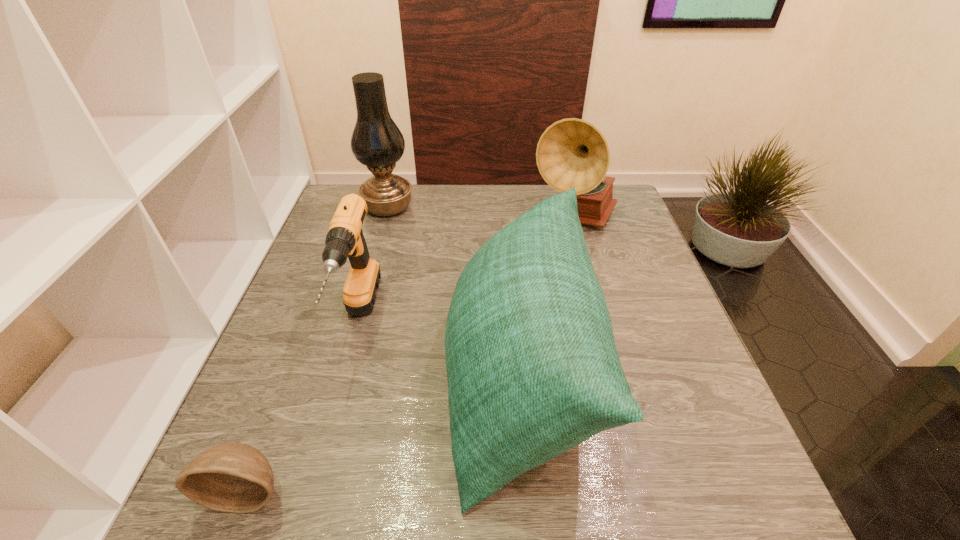
This screenshot has height=540, width=960. What are the coordinates of `free space located 0.160m at the tip of the drill` in the screenshot? It's located at (321, 456).

You are a GUI agent. You are given a task and a screenshot of the screen. Output one action in this format:
    pyautogui.click(x=<x>, y=<y>)
    Task: Click on the vacant region located on the back of the bowl
    
    Given the screenshot: What is the action you would take?
    pyautogui.click(x=283, y=399)

You are a GUI agent. You are given a task and a screenshot of the screen. Output one action in this format:
    pyautogui.click(x=<x>, y=<y>)
    Task: Click on the oil lamp located in the far edge section of the desktop
    The width and height of the screenshot is (960, 540).
    Given the screenshot: What is the action you would take?
    pyautogui.click(x=376, y=142)

I want to click on phonograph record present at the far edge, so click(572, 152).

Find the location of `cushion that is at the near edge`. cushion that is at the near edge is located at coordinates coord(532,367).

Identify the location of bowl that is positioned at the near edge. The width and height of the screenshot is (960, 540). [233, 477].

You are a GUI agent. You are given a task and a screenshot of the screen. Output one action in this format:
    pyautogui.click(x=<x>, y=<y>)
    Task: Click on the oil lamp present at the left edge
    This screenshot has width=960, height=540.
    Given the screenshot: What is the action you would take?
    pyautogui.click(x=376, y=142)

The image size is (960, 540). I want to click on drill that is at the left edge, so (345, 239).

Locate an element on the screen. bowl that is positioned at the left edge is located at coordinates (233, 477).

What are the coordinates of `object located at the right edge` in the screenshot? It's located at (572, 152).